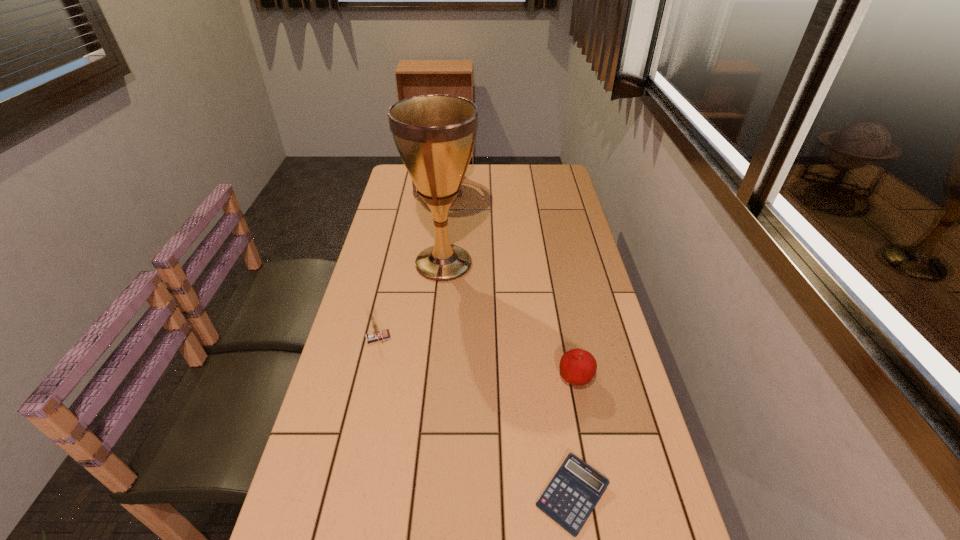
Where is `trophy cup`? The width and height of the screenshot is (960, 540). trophy cup is located at coordinates (435, 135).

The width and height of the screenshot is (960, 540). Find the location of `the tallest object`. the tallest object is located at coordinates (435, 135).

I want to click on globe, so click(x=415, y=194).

Find the location of a particular element. The width and height of the screenshot is (960, 540). the second tallest object is located at coordinates (415, 194).

Find the location of a particular element. Image resolution: width=960 pixels, height=540 pixels. the third shortest object is located at coordinates tap(376, 335).

Find the location of `matchbox`. matchbox is located at coordinates (376, 335).

Where is `apple`? The image size is (960, 540). apple is located at coordinates (577, 367).

This screenshot has width=960, height=540. Find the location of `the fourth tallest object`. the fourth tallest object is located at coordinates (577, 367).

Where is `calculator`? calculator is located at coordinates (572, 494).

Locate an element on the screen. The width and height of the screenshot is (960, 540). the nearest object is located at coordinates (572, 494).